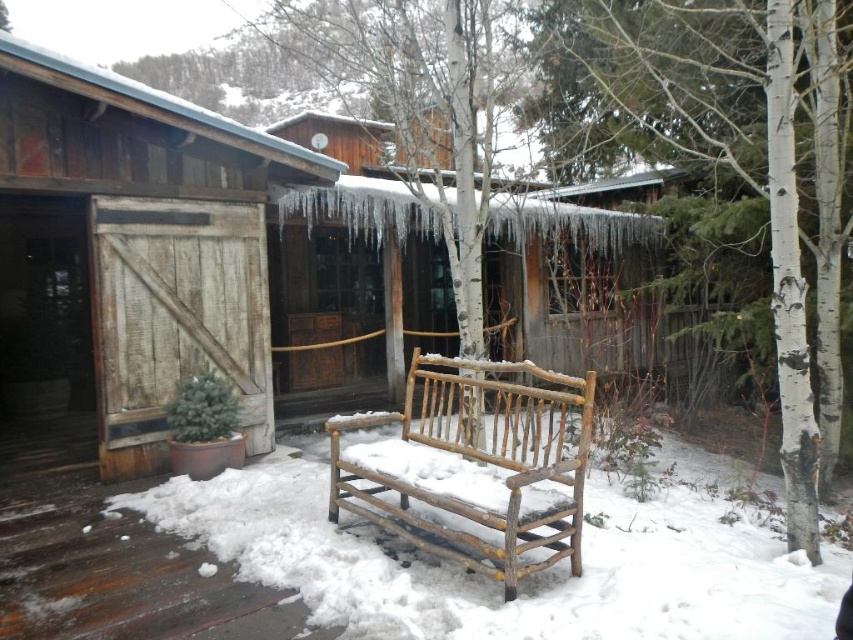
Question: Among these points, which one is farthest from the camera?

Choices:
 (A) (506, 419)
 (B) (805, 532)
 (C) (62, 156)
 (D) (160, 200)

Answer: (D)

Question: Can you confirm if white bark tree at center right is positioned below rustic wood bench at center?

Choices:
 (A) no
 (B) yes

Answer: (A)

Question: Can you confirm if weathered wood cabin at left is bigger than white bark tree at center right?

Choices:
 (A) no
 (B) yes

Answer: (A)

Question: Does weathered wood cabin at left appear under weathered wood barn door at left?

Choices:
 (A) yes
 (B) no

Answer: (A)

Question: Which point is farther from the camera taking this photo?

Choices:
 (A) (595, 387)
 (B) (55, 339)

Answer: (B)

Question: Among these points, which one is nearest to the camera?

Choices:
 (A) coord(122,300)
 (B) coord(496,456)

Answer: (B)